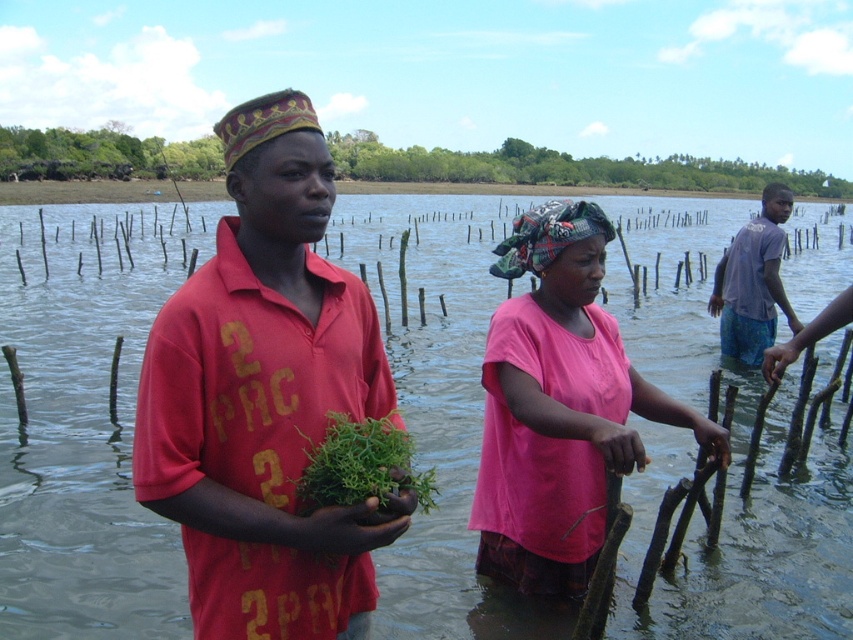
You are a photographer trying to capture both the matte red shirt at center and the pink fabric headscarf at center in a single frame. Based on their heights, which object should you focus on first to ensure both are in focus?

The matte red shirt at center is shorter than the pink fabric headscarf at center. To ensure both are in focus, focus on the pink fabric headscarf at center first since it is taller, allowing the shorter matte red shirt at center to fall within the depth of field.

You are a researcher studying mangrove ecosystems. You need to collect samples from both the clear water at center and the green leafy plant at center. Based on their positions, which one should you reach for first without moving your position?

The green leafy plant at center should be reached for first because the clear water at center is positioned to its right side, meaning the plant is closer to your left side and thus more accessible without moving.

You are a photographer trying to capture both the clear water at center and the green leafy plant at center in a single shot. Which object should you focus on first to ensure both are in the frame?

You should focus on the clear water at center first because it is closer to you than the green leafy plant at center, ensuring both are in the frame.